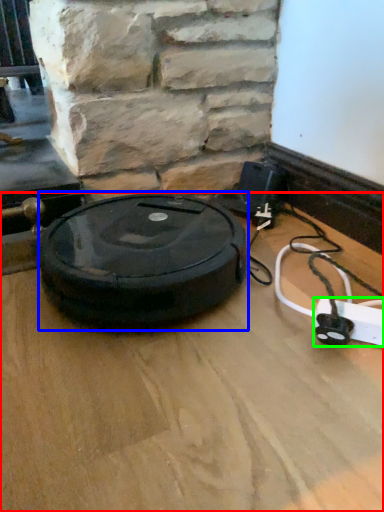
Question: Estimate the real-world distances between objects in this image. Which object is closer to surface (highlighted by a red box), car tire (highlighted by a blue box) or extension cord (highlighted by a green box)?

Choices:
 (A) car tire
 (B) extension cord

Answer: (A)